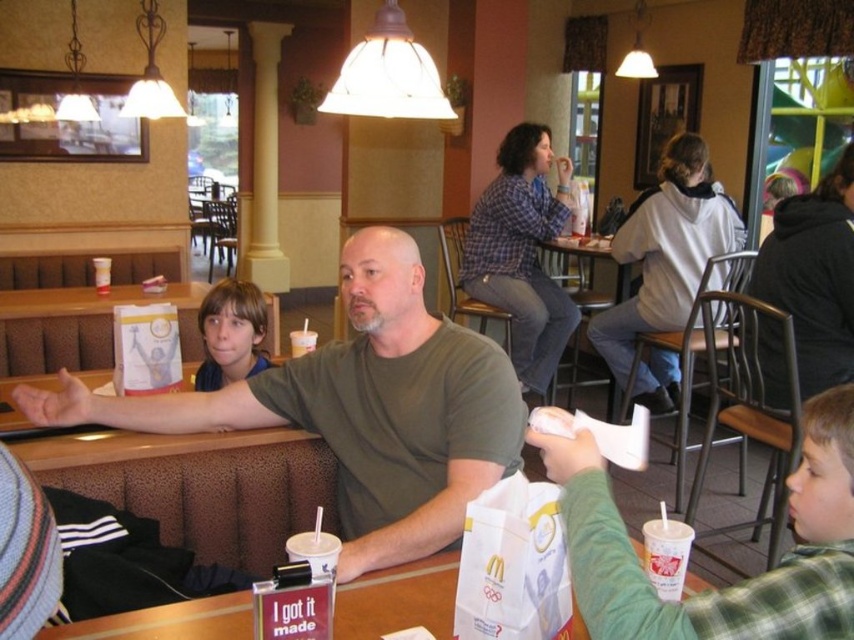
Question: Can you confirm if green plaid shirt at lower right is bigger than white paper bag at center?

Choices:
 (A) no
 (B) yes

Answer: (B)

Question: Does matte green shirt at center appear on the right side of wooden table at center?

Choices:
 (A) no
 (B) yes

Answer: (A)

Question: Is matte green shirt at center above wooden table at center?

Choices:
 (A) no
 (B) yes

Answer: (A)

Question: Considering the real-world distances, which object is farthest from the white paper bag at center?

Choices:
 (A) green plaid shirt at lower right
 (B) matte green shirt at center
 (C) light brown hair at center

Answer: (C)

Question: Which of these objects is positioned farthest from the green plaid shirt at lower right?

Choices:
 (A) white paper bag at center
 (B) wooden table at center
 (C) matte green shirt at center
 (D) light brown hair at center

Answer: (B)

Question: Considering the real-world distances, which object is closest to the wooden table at center?

Choices:
 (A) white paper bag at center
 (B) green plaid shirt at lower right
 (C) light brown hair at center
 (D) matte green shirt at center

Answer: (C)